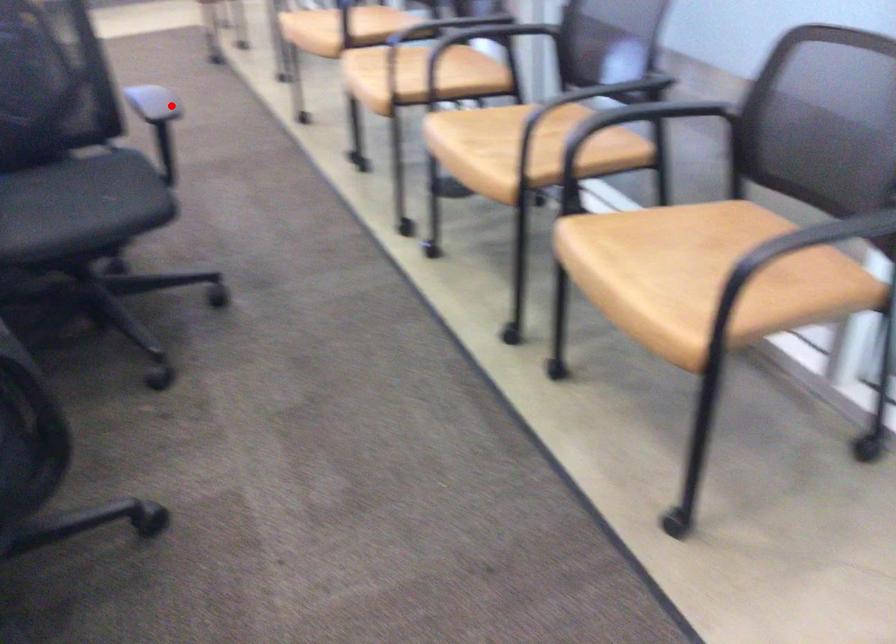
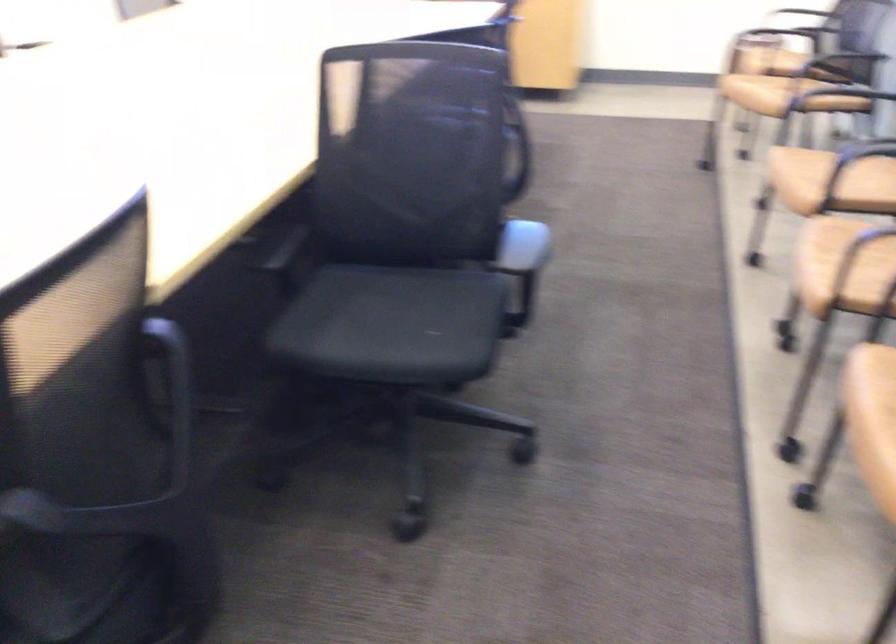
Question: I am providing you with two images of the same scene from different viewpoints. A red point is shown in image1. For the corresponding object point in image2, is it positioned nearer or farther from the camera?

Choices:
 (A) Nearer
 (B) Farther

Answer: (A)